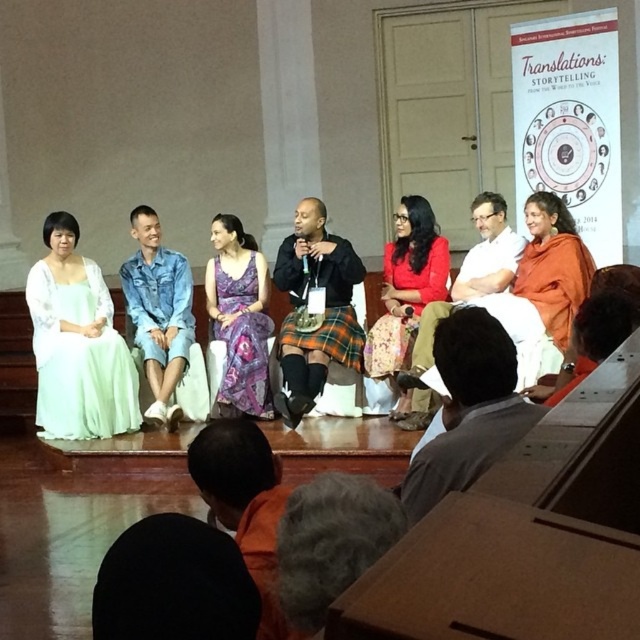
Does point (504, 440) lie in front of point (616, 301)?

Yes, point (504, 440) is closer to viewer.

Can you confirm if gray fabric at lower center is positioned above orange fabric at lower right?

No, gray fabric at lower center is not above orange fabric at lower right.

This screenshot has height=640, width=640. Find the location of `gray fabric at lower center`. gray fabric at lower center is located at coordinates [x=468, y=410].

What do you see at coordinates (80, 358) in the screenshot?
I see `light green satin dress at left` at bounding box center [80, 358].

Does light green satin dress at left have a lesser width compared to orange fabric at lower right?

No, light green satin dress at left is not thinner than orange fabric at lower right.

Does point (36, 410) come closer to viewer compared to point (608, 323)?

No, (36, 410) is further to viewer.

Locate an element on the screen. This screenshot has width=640, height=640. light green satin dress at left is located at coordinates (80, 358).

Is fuzzy gray hair at lower center to the right of plaid fabric kilt at center from the viewer's perspective?

Yes, fuzzy gray hair at lower center is to the right of plaid fabric kilt at center.

Does fuzzy gray hair at lower center appear on the left side of plaid fabric kilt at center?

Incorrect, fuzzy gray hair at lower center is not on the left side of plaid fabric kilt at center.

Between point (388, 516) and point (308, 337), which one is positioned behind?

The point (308, 337) is more distant.

This screenshot has width=640, height=640. I want to click on fuzzy gray hair at lower center, so click(330, 541).